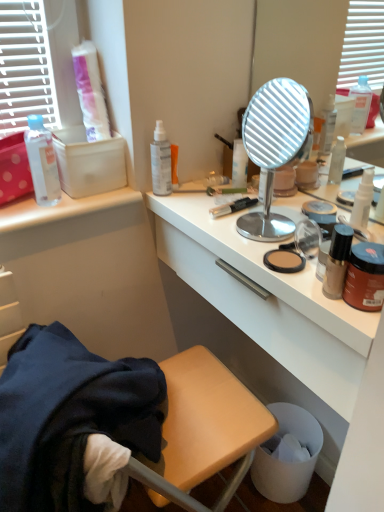
Where is `vacant space to the left of white glossy spray bottle at upper right, the 3th bottle from the back`? Image resolution: width=384 pixels, height=512 pixels. vacant space to the left of white glossy spray bottle at upper right, the 3th bottle from the back is located at coordinates (251, 221).